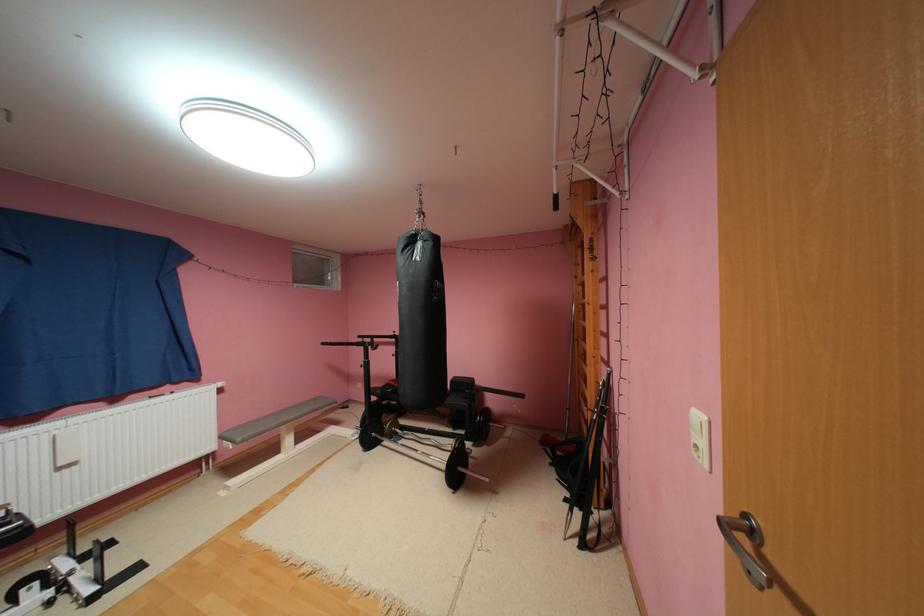
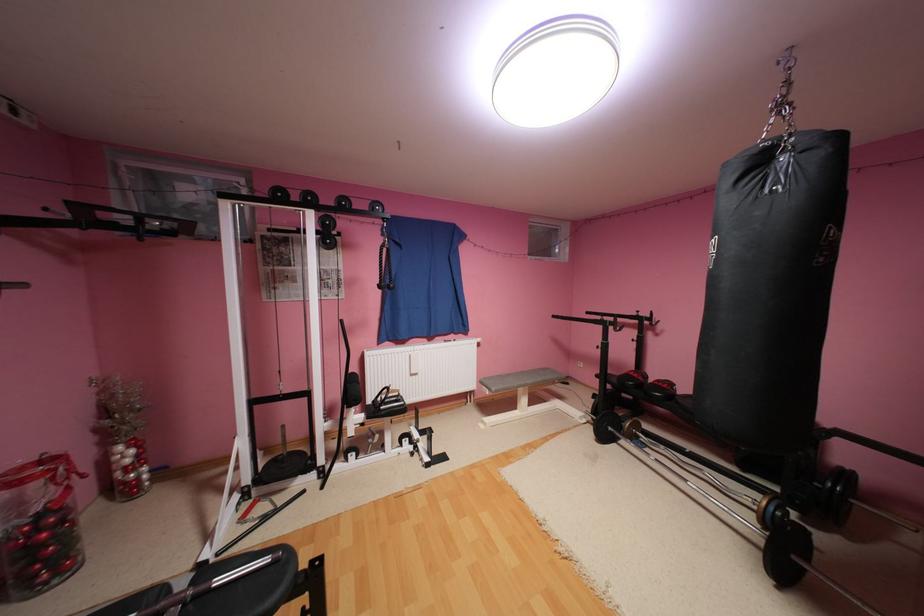
The point at (366, 436) is marked in the first image. Where is the corresponding point in the second image?

(593, 419)